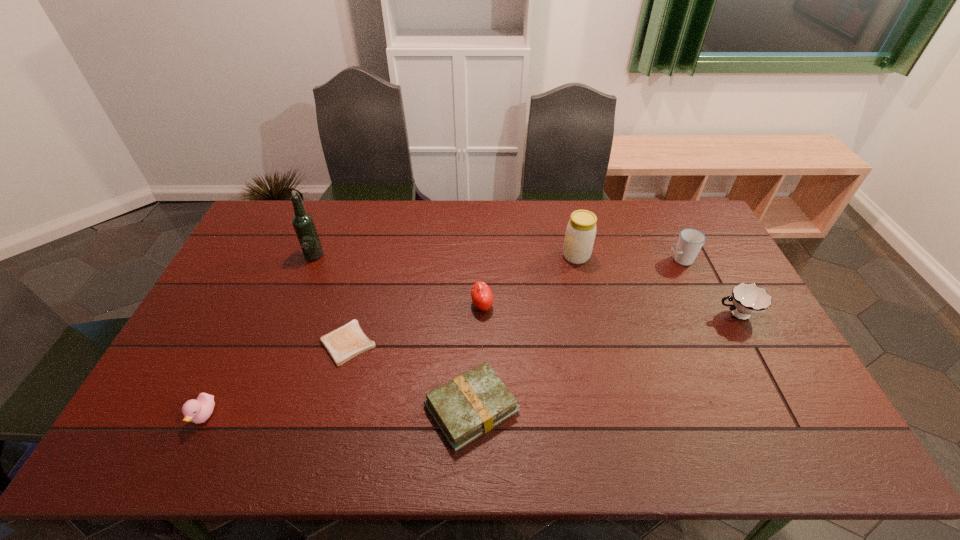
Identify the location of vacant space situated 0.220m on the side of the shorter cup with the handle. The height and width of the screenshot is (540, 960). (641, 314).

The image size is (960, 540). I want to click on vacant point located 0.050m on the front-facing side of the duckling, so click(187, 453).

I want to click on vacant space situated on the right of the book, so click(579, 408).

Where is `free spot located 0.050m on the right of the shortest object`? free spot located 0.050m on the right of the shortest object is located at coordinates (394, 343).

You are a GUI agent. You are given a task and a screenshot of the screen. Output one action in this format:
    pyautogui.click(x=<x>, y=<y>)
    Task: Click on the duckling that is positioned at the near edge
    This screenshot has height=540, width=960.
    Given the screenshot: What is the action you would take?
    pyautogui.click(x=197, y=411)

Identify the location of book that is at the near edge. The height and width of the screenshot is (540, 960). (470, 405).

The image size is (960, 540). What are the coordinates of `object present at the left edge` in the screenshot? It's located at (197, 411).

Identify the location of object at the near left corner. This screenshot has width=960, height=540. (197, 411).

In the image, there is a desktop. At what (x,y) coordinates should I click in order to perform the action: click on vacant area at the far edge. Please return your answer as a coordinate pair (x, y). The height and width of the screenshot is (540, 960). Looking at the image, I should click on (323, 209).

The image size is (960, 540). I want to click on vacant area at the near edge of the desktop, so click(671, 456).